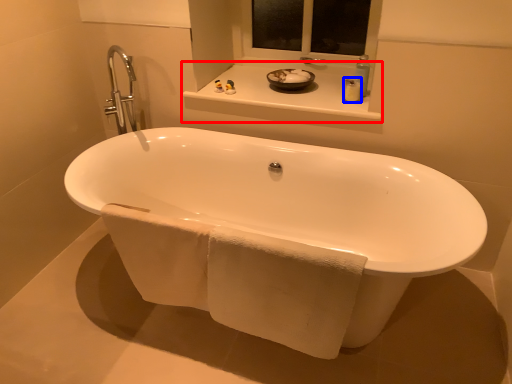
Question: Among these objects, which one is nearest to the camera, window sill (highlighted by a red box) or toiletry (highlighted by a blue box)?

Choices:
 (A) window sill
 (B) toiletry

Answer: (A)